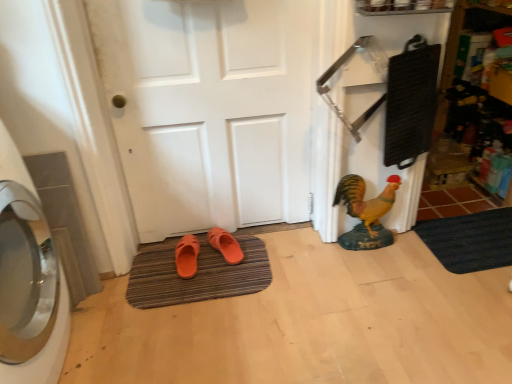
At what (x,y) coordinates should I click in order to perform the action: click on unoccupied region to the right of orange rubber slipper at lower center, positioned as the first footwear in left-to-right order. Please return your answer as a coordinate pair (x, y). Looking at the image, I should click on (224, 267).